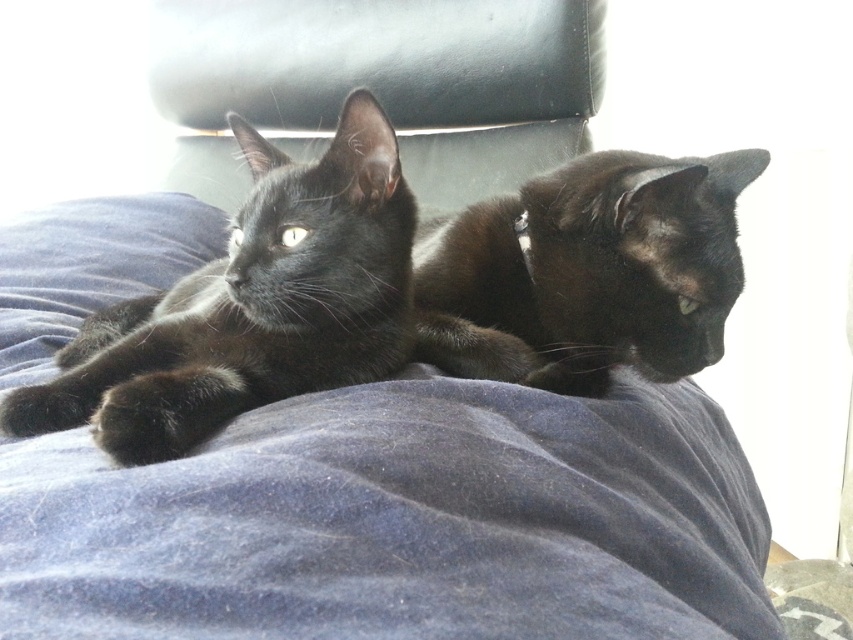
You are trying to place a small decorative pillow on the velvety blue blanket at center without disturbing the shiny black cat at center. Based on the size of the blanket and the cat, can you fit the pillow on the blanket while keeping it away from the cat?

The velvety blue blanket at center is wider than the shiny black cat at center, so yes, you can place the small decorative pillow on the blanket while keeping it away from the cat.